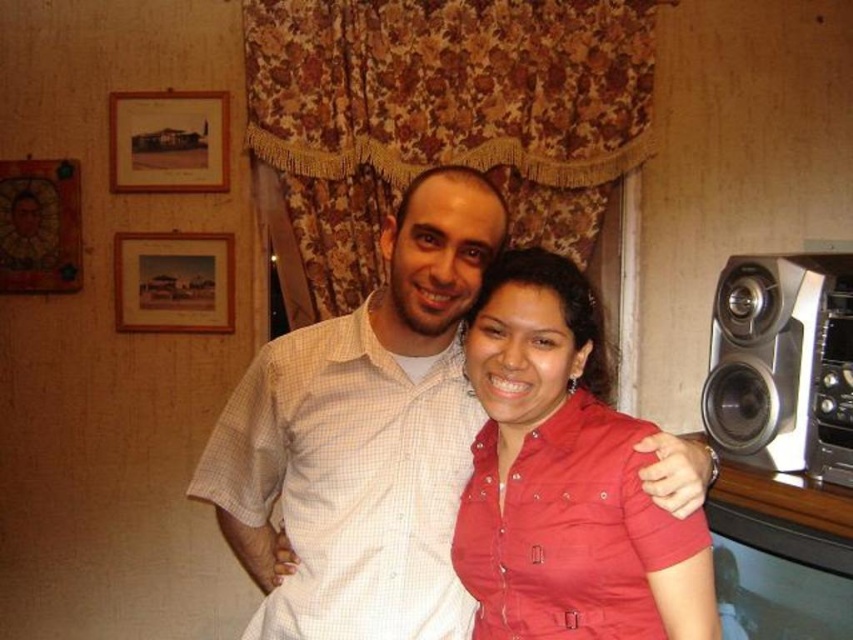
Is point (434, 275) positioned in front of point (624, 547)?

No, (434, 275) is further to viewer.

Is white checkered shirt at center below matte red shirt at center?

No.

This screenshot has height=640, width=853. What are the coordinates of `white checkered shirt at center` in the screenshot? It's located at (363, 436).

What are the coordinates of `white checkered shirt at center` in the screenshot? It's located at (363, 436).

Is white checkered shirt at center positioned at the back of silver metallic speaker at right?

No, it is not.

Between white checkered shirt at center and silver metallic speaker at right, which one has less height?

With less height is silver metallic speaker at right.

Does point (355, 449) come farther from viewer compared to point (805, 406)?

No, it is not.

Where is `white checkered shirt at center`? white checkered shirt at center is located at coordinates (363, 436).

Is matte red shirt at center positioned in front of silver metallic speaker at right?

Yes, matte red shirt at center is closer to the viewer.

Which is behind, point (618, 564) or point (776, 262)?

The point (776, 262) is behind.

Who is more distant from viewer, [538,605] or [807,296]?

Positioned behind is point [807,296].

You are a GUI agent. You are given a task and a screenshot of the screen. Output one action in this format:
    pyautogui.click(x=<x>, y=<y>)
    Task: Click on the matte red shirt at center
    
    Given the screenshot: What is the action you would take?
    pyautogui.click(x=560, y=476)